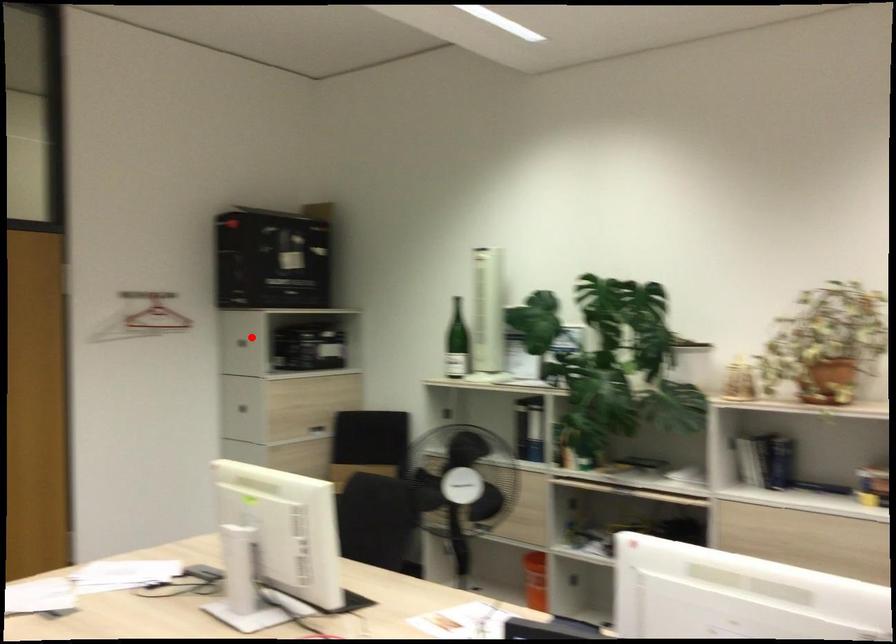
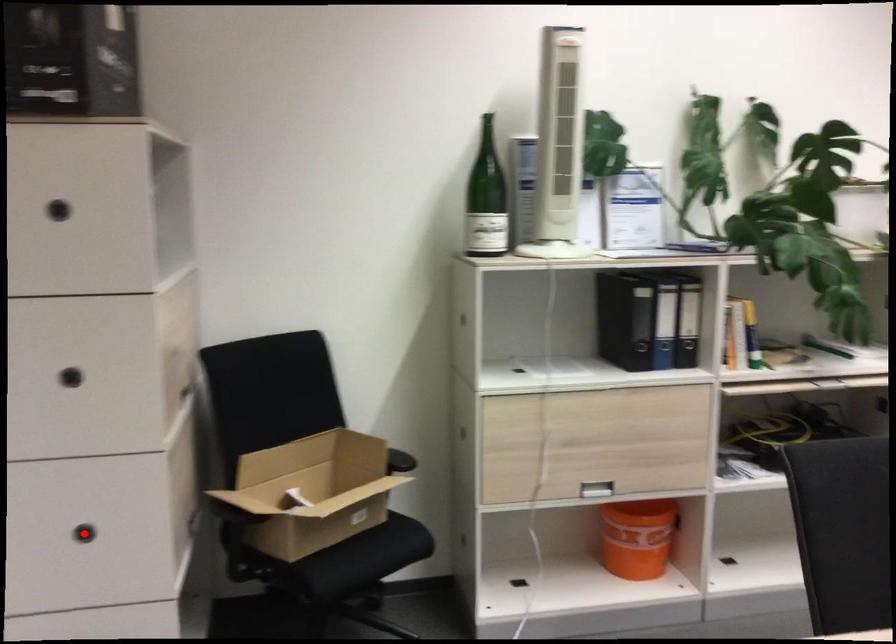
I am providing you with two images of the same scene from different viewpoints. A red point is marked on the first image and another point is marked on the second image. Does the point marked in image1 correspond to the same location as the one in image2?

No